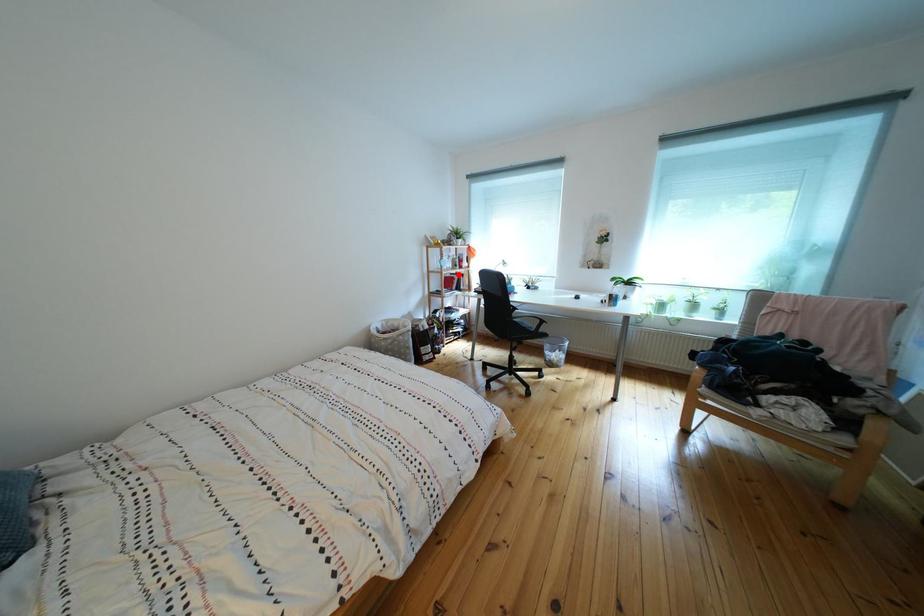
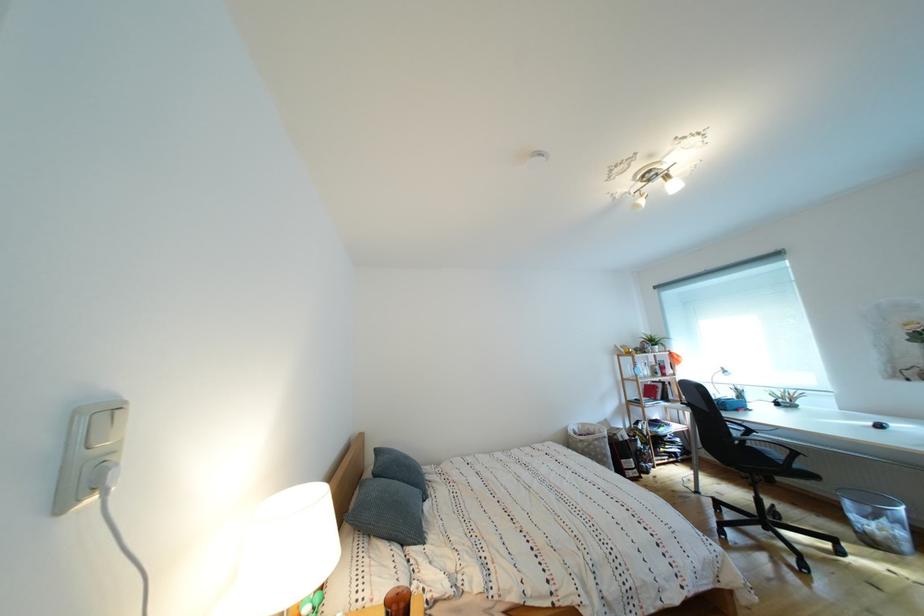
Question: I am providing you with two images of the same scene from different viewpoints. In image1, a red point is highlighted. Considering the same 3D point in image2, which of the following is correct?

Choices:
 (A) It is closer
 (B) It is farther

Answer: (B)